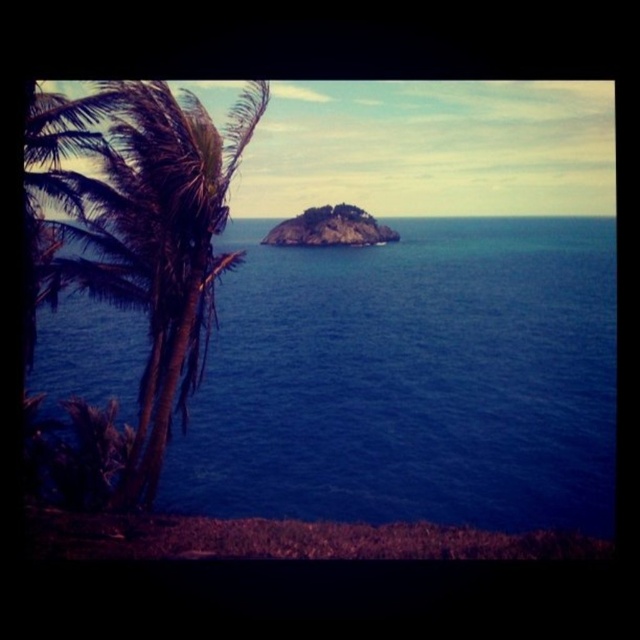
You are standing on the beach looking at the palm tree and the ocean. There is a specific point marked at coordinates (157, 243). Which object is this point located on?

The point at coordinates (157, 243) is on the green leafy palm tree at left.

You are a drone operator trying to capture a photo of the blue liquid water at center and brown grass at lower center. Which object will occupy more horizontal space in the photo?

The blue liquid water at center has a greater width than the brown grass at lower center, so it will occupy more horizontal space in the photo.

Looking at this image, you are a hiker who wants to cross the area shown in the image. You see the blue liquid water at center and the brown grass at lower center. Which one is safer to walk on?

The brown grass at lower center is safer to walk on because the blue liquid water at center is positioned over it, indicating the grass is solid ground while the water is a liquid surface.